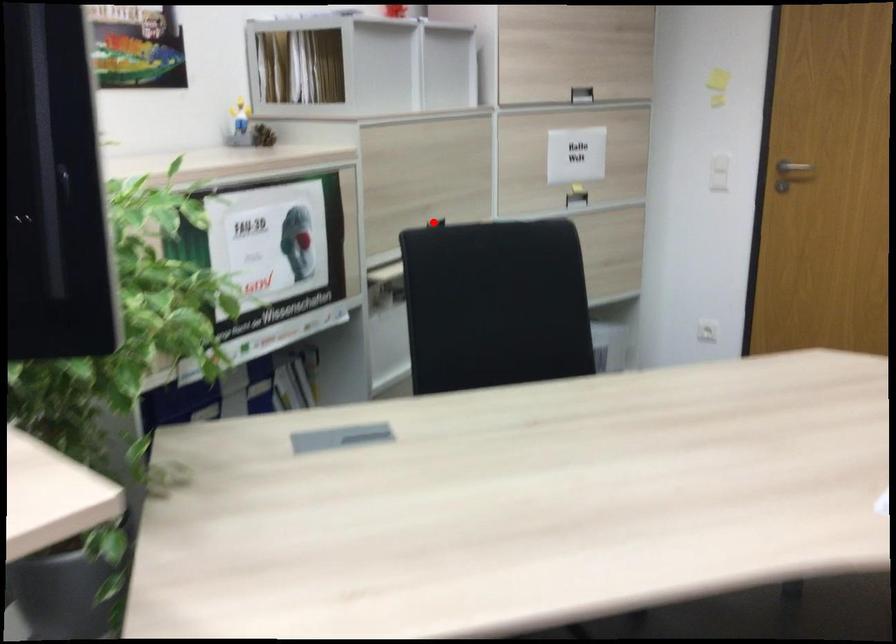
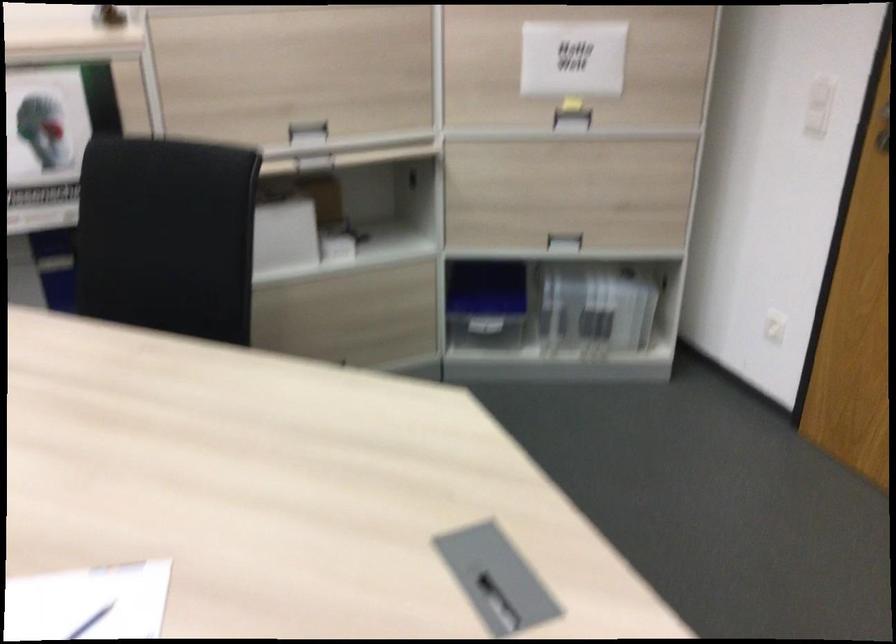
Find the pixel in the second image that matches the highlighted location in the first image.

(307, 129)